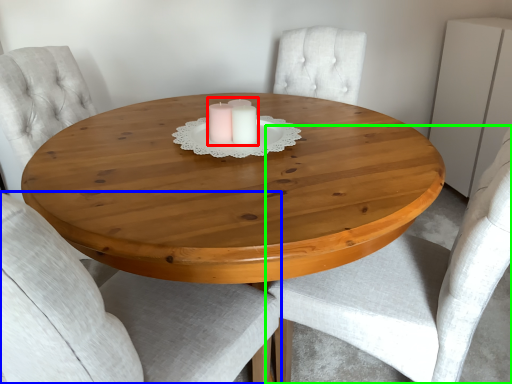
Question: Which object is the farthest from candle holder (highlighted by a red box)? Choose among these: chair (highlighted by a blue box) or chair (highlighted by a green box).

Choices:
 (A) chair
 (B) chair

Answer: (B)